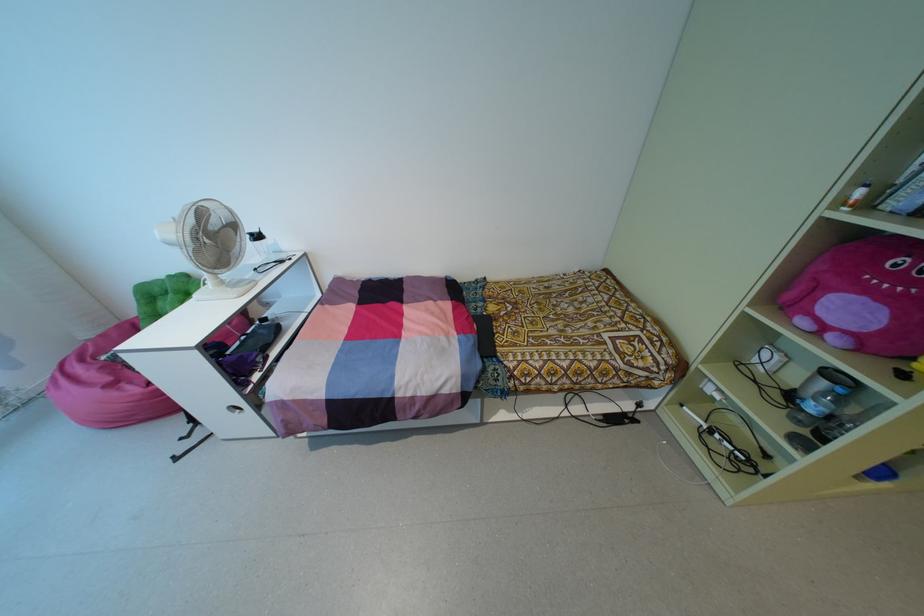
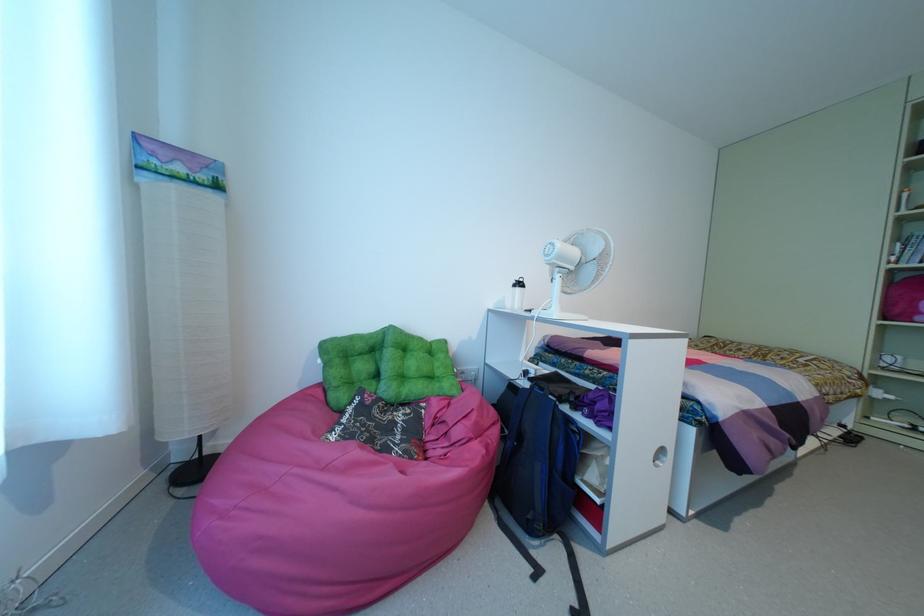
Locate, in the second image, the point that corresponds to the point at 156,289 in the first image.

(359, 345)